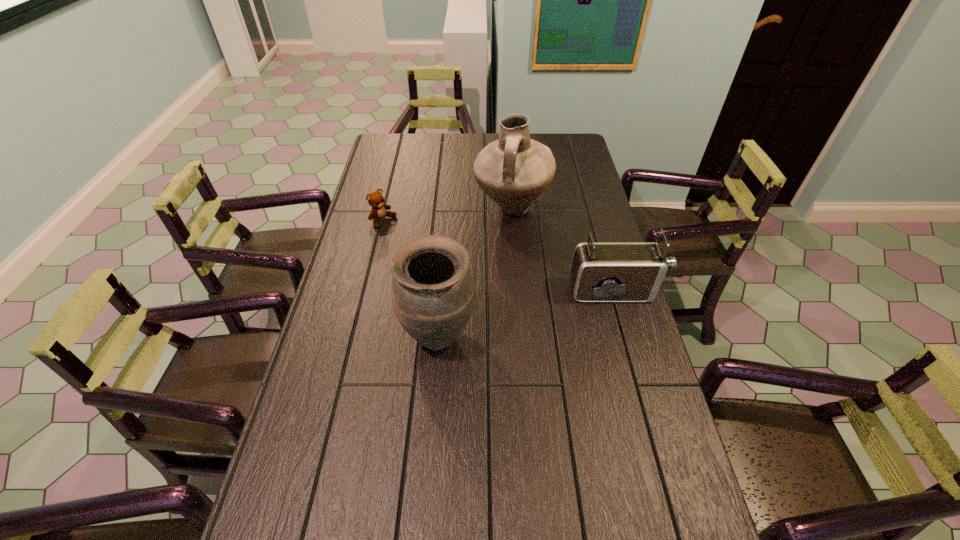
Where is `object that is the third nearest to the pitcher`? This screenshot has width=960, height=540. object that is the third nearest to the pitcher is located at coordinates (432, 292).

Where is `free point that satisfies the following two spatial constraints: 1. on the back side of the tallest object; 2. on the right side of the nearest object`? free point that satisfies the following two spatial constraints: 1. on the back side of the tallest object; 2. on the right side of the nearest object is located at coordinates (448, 209).

The image size is (960, 540). Find the location of `free space that satisfies the following two spatial constraints: 1. on the back side of the nearest object; 2. on the right side of the tallest object`. free space that satisfies the following two spatial constraints: 1. on the back side of the nearest object; 2. on the right side of the tallest object is located at coordinates (448, 209).

What are the coordinates of `vacant space that satisfies the following two spatial constraints: 1. on the front side of the teddy bear; 2. on the right side of the nearest object` in the screenshot? It's located at (355, 335).

In order to click on blank space that satisfies the following two spatial constraints: 1. on the back side of the teddy bear; 2. on the right side of the tallest object in this screenshot , I will do `click(386, 209)`.

You are a GUI agent. You are given a task and a screenshot of the screen. Output one action in this format:
    pyautogui.click(x=<x>, y=<y>)
    Task: Click on the vacant space that satisfies the following two spatial constraints: 1. on the front side of the third farthest object; 2. at the lens of the tallest object
    This screenshot has width=960, height=540.
    Given the screenshot: What is the action you would take?
    pyautogui.click(x=518, y=292)

This screenshot has width=960, height=540. What are the coordinates of `vacant point that satisfies the following two spatial constraints: 1. on the front side of the leftmost object; 2. on the right side of the urn` in the screenshot? It's located at point(355,335).